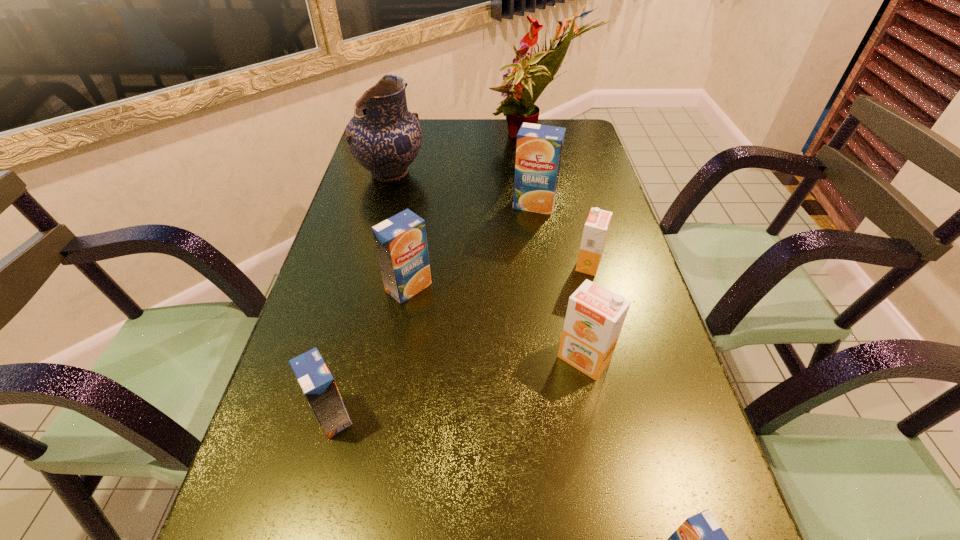
Locate an element on the screen. The width and height of the screenshot is (960, 540). bouquet is located at coordinates (x=519, y=106).

Identify the location of the second tallest object. (384, 137).

The width and height of the screenshot is (960, 540). What are the coordinates of `blue pottery` in the screenshot? It's located at (384, 137).

You are a GUI agent. You are given a task and a screenshot of the screen. Output one action in this format:
    pyautogui.click(x=<x>, y=<y>)
    Task: Click on the sixth nearest object
    The width and height of the screenshot is (960, 540).
    Given the screenshot: What is the action you would take?
    pyautogui.click(x=539, y=148)

The height and width of the screenshot is (540, 960). I want to click on the farthest orange_juice, so click(x=539, y=148).

At what (x,y) coordinates should I click in order to perform the action: click on the second farthest blue orange_juice. Please return your answer as a coordinate pair (x, y). Looking at the image, I should click on (401, 243).

Find the location of a particular element. the second orange_juice from left to right is located at coordinates (401, 243).

You are a GUI agent. You are given a task and a screenshot of the screen. Output one action in this format:
    pyautogui.click(x=<x>, y=<y>)
    Task: Click on the third nearest object
    The height and width of the screenshot is (540, 960).
    Given the screenshot: What is the action you would take?
    pyautogui.click(x=595, y=316)

Image resolution: width=960 pixels, height=540 pixels. I want to click on the third nearest orange_juice, so click(x=595, y=316).

Identify the location of the leftmost blue orange_juice. (314, 377).